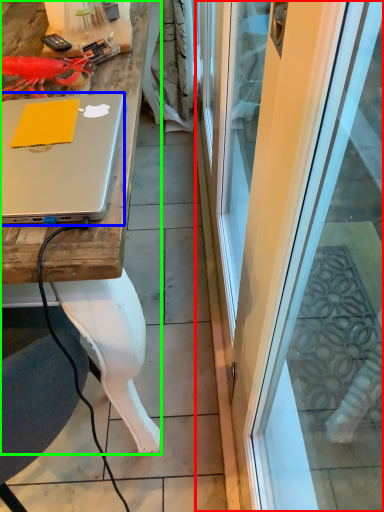
Question: Estimate the real-world distances between objects in this image. Which object is closer to screen door (highlighted by a red box), laptop (highlighted by a blue box) or desk (highlighted by a green box)?

Choices:
 (A) laptop
 (B) desk

Answer: (B)